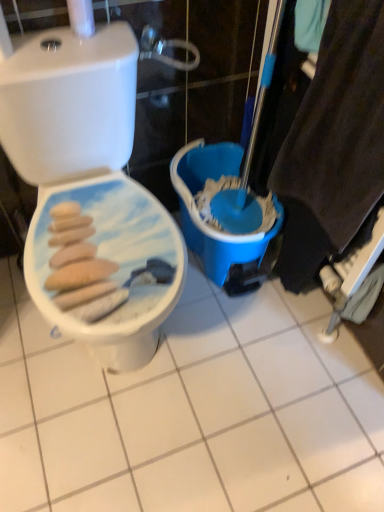
Where is `free location to the right of white glossy toilet seat at left`? The width and height of the screenshot is (384, 512). free location to the right of white glossy toilet seat at left is located at coordinates (259, 364).